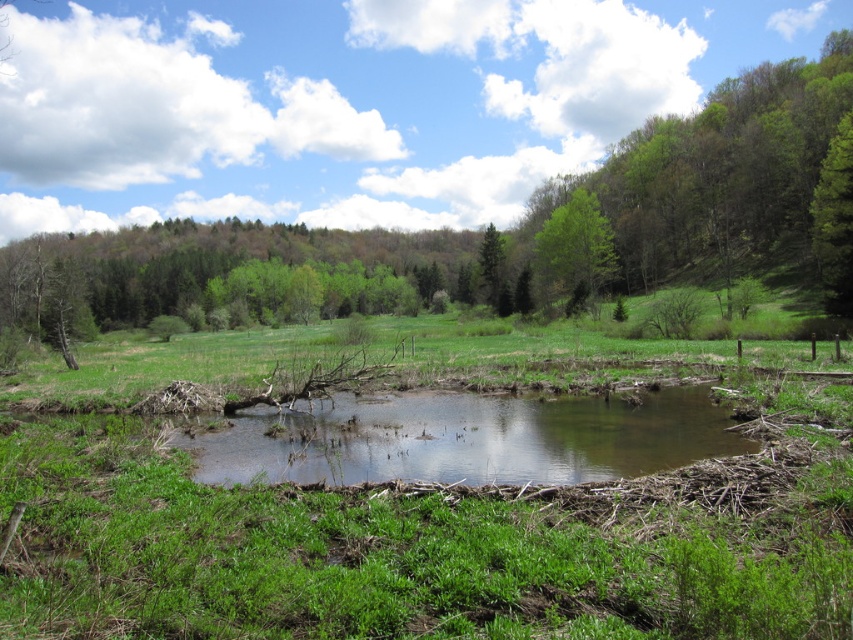
You are standing at the edge of the water and want to walk towards the green leafy tree at center and the green matte tree at upper right. Which tree will you reach first?

You will reach the green leafy tree at center first because it is closer to you than the green matte tree at upper right.

You are standing at the point marked by the coordinates point (834, 220). Which direction should you walk to reach the green matte tree at upper right?

The point (834, 220) is the location of the green matte tree at upper right, so you are already at the tree.

You are a hiker who wants to cross the water using the fallen tree trunk. The green matte tree at upper right and the green matte tree at center are both visible from your position. Which tree has a wider trunk?

The green matte tree at upper right has a wider trunk than the green matte tree at center since its width surpasses the latter.